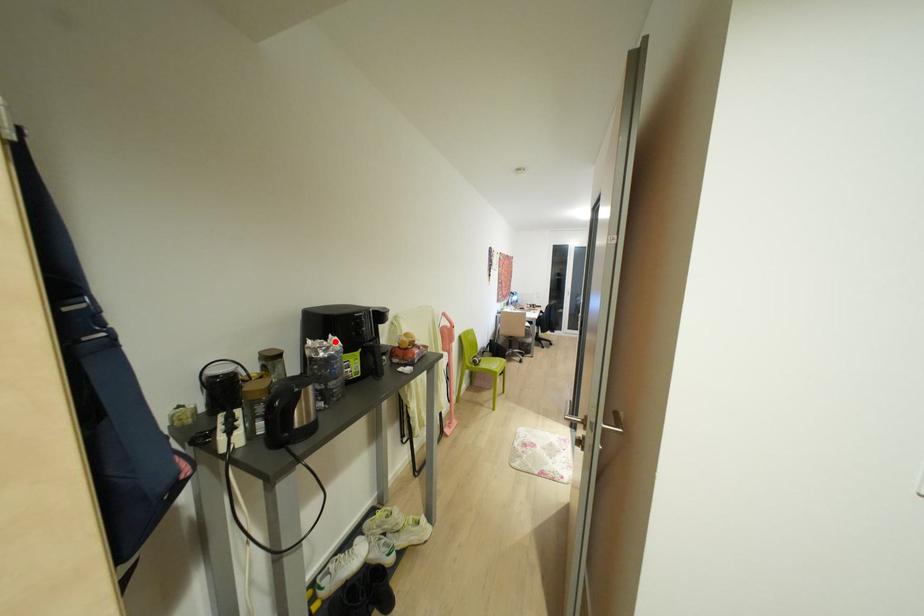
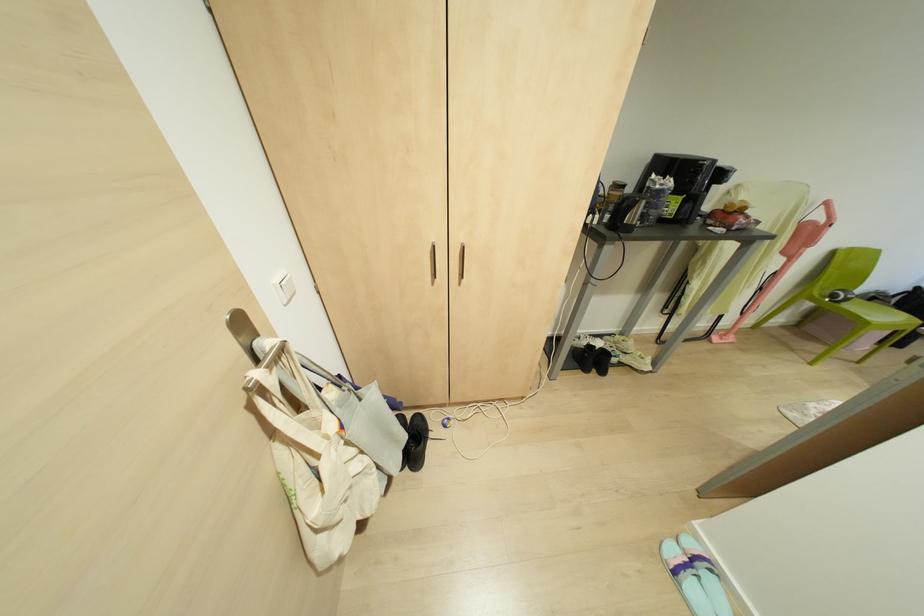
Find the pixel in the second image that matches the highlighted location in the first image.

(670, 182)